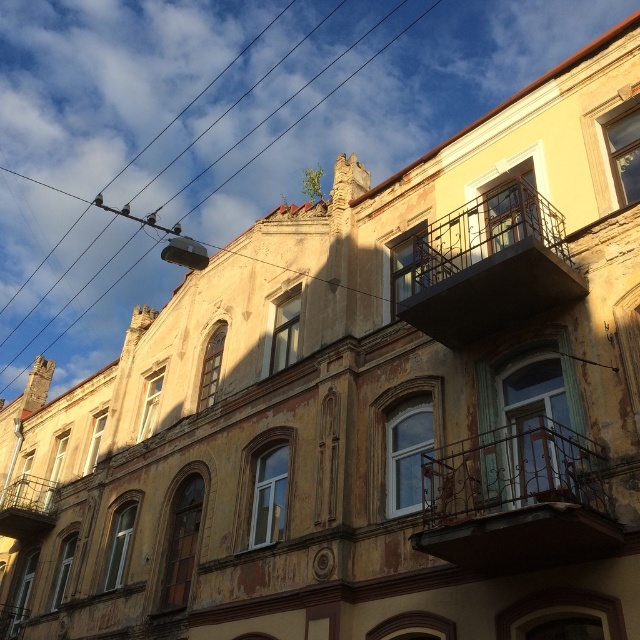
Is point (490, 234) farther from viewer compared to point (36, 476)?

No, it is not.

Measure the distance between point [476,262] and camera.

They are 113.89 feet apart.

Find the location of a particular element. black metal balcony at upper right is located at coordinates (490, 266).

Can you confirm if iron/ornate balcony at center is positioned above black metal balcony at upper right?

No.

Between point (550, 486) and point (435, 336), which one is positioned in front?

Point (550, 486) is in front.

What are the coordinates of `iron/ornate balcony at center` in the screenshot? It's located at (516, 499).

Between point (497, 504) and point (339, 54), which one is positioned behind?

Positioned behind is point (339, 54).

Does point (490, 493) lie in front of point (3, 388)?

Yes, point (490, 493) is closer to viewer.

Where is `iron/ornate balcony at center`? iron/ornate balcony at center is located at coordinates click(x=516, y=499).

You are a GUI agent. You are given a task and a screenshot of the screen. Output one action in this format:
    pyautogui.click(x=<x>, y=<y>)
    Task: Click on the iron/ornate balcony at center
    This screenshot has height=640, width=640.
    Given the screenshot: What is the action you would take?
    pyautogui.click(x=516, y=499)